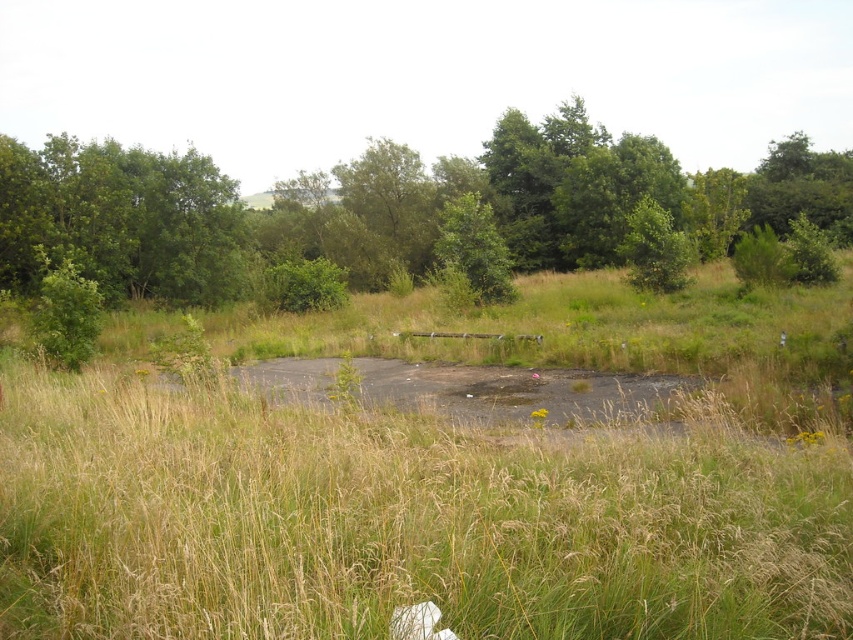
Does point (103, 259) come closer to viewer compared to point (473, 234)?

No, it is not.

Which is more to the left, green leafy tree at upper left or green leafy tree at center?

Positioned to the left is green leafy tree at center.

You are a GUI agent. You are given a task and a screenshot of the screen. Output one action in this format:
    pyautogui.click(x=<x>, y=<y>)
    Task: Click on the green leafy tree at upper left
    
    Given the screenshot: What is the action you would take?
    pyautogui.click(x=380, y=205)